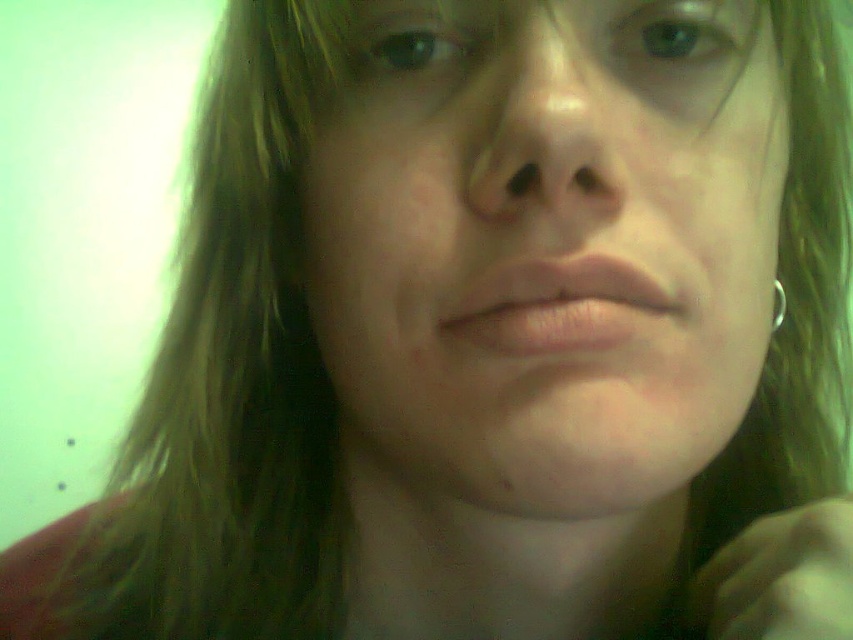
Question: Is the position of smooth skin face at center more distant than that of pink matte lips at center?

Choices:
 (A) yes
 (B) no

Answer: (B)

Question: Which object is the farthest from the smooth skin face at center?

Choices:
 (A) silver metallic ring at lower right
 (B) pink matte lips at center

Answer: (A)

Question: Estimate the real-world distances between objects in this image. Which object is farther from the silver metallic ring at lower right?

Choices:
 (A) smooth skin face at center
 (B) pink matte lips at center

Answer: (A)

Question: Does smooth skin face at center have a lesser width compared to pink matte lips at center?

Choices:
 (A) yes
 (B) no

Answer: (B)

Question: Can you confirm if smooth skin face at center is thinner than silver metallic ring at lower right?

Choices:
 (A) yes
 (B) no

Answer: (B)

Question: Which of the following is the closest to the observer?

Choices:
 (A) (567, 316)
 (B) (555, 269)

Answer: (B)